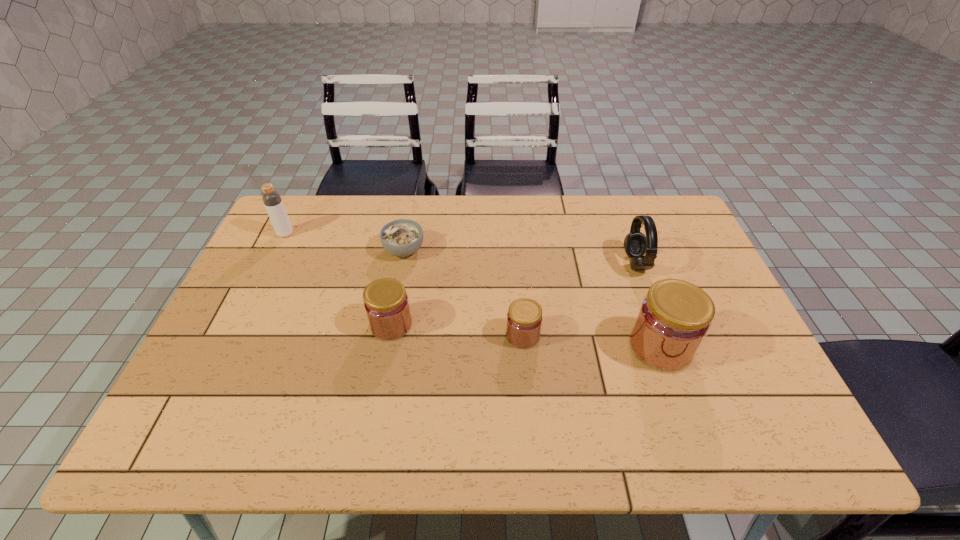
Locate an element on the screen. jam that is the second closest to the headset is located at coordinates (524, 318).

Where is `free space that satisfies the following two spatial constraints: 1. on the front side of the second shortest jam; 2. on the left side of the rightmost jam`? This screenshot has width=960, height=540. free space that satisfies the following two spatial constraints: 1. on the front side of the second shortest jam; 2. on the left side of the rightmost jam is located at coordinates (387, 347).

Identify the location of free space that satisfies the following two spatial constraints: 1. on the front side of the leftmost jam; 2. on the right side of the bottle. Image resolution: width=960 pixels, height=540 pixels. (241, 325).

Locate an element on the screen. The height and width of the screenshot is (540, 960). vacant area that satisfies the following two spatial constraints: 1. on the front side of the second shortest object; 2. on the left side of the soup bowl is located at coordinates (389, 335).

Where is `vacant space that satisfies the following two spatial constraints: 1. on the front side of the bottle; 2. on the left side of the fourth tallest object`? vacant space that satisfies the following two spatial constraints: 1. on the front side of the bottle; 2. on the left side of the fourth tallest object is located at coordinates (241, 325).

Image resolution: width=960 pixels, height=540 pixels. Find the location of `vacant region that satisfies the following two spatial constraints: 1. on the front side of the rightmost jam; 2. on the left side of the shortest jam`. vacant region that satisfies the following two spatial constraints: 1. on the front side of the rightmost jam; 2. on the left side of the shortest jam is located at coordinates coord(523,347).